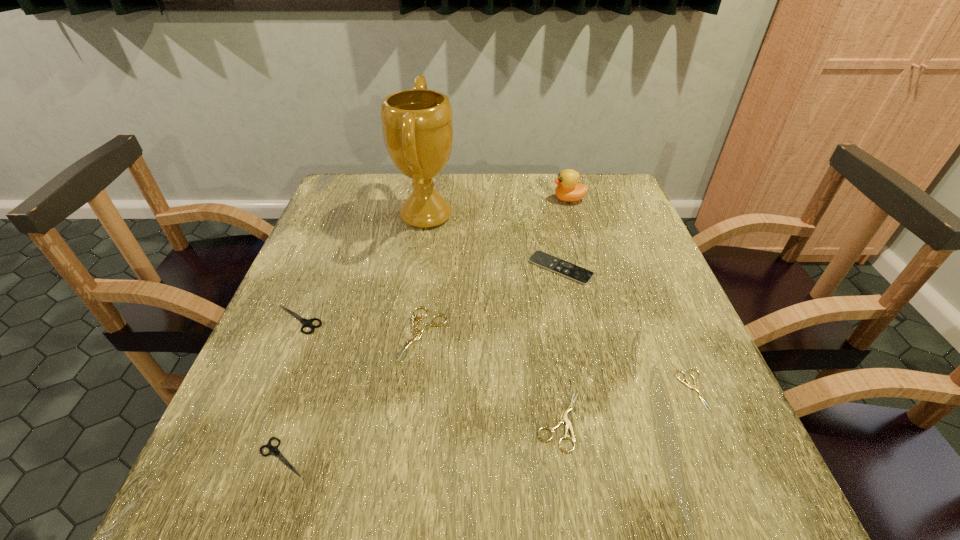
Locate an element on the screen. This screenshot has height=540, width=960. blank region between the third shears from left to right and the tallest object is located at coordinates (424, 275).

At what (x,y) coordinates should I click in order to perform the action: click on empty space that is in between the smallest beige shears and the bigger black shears. Please return your answer as a coordinate pair (x, y). The image size is (960, 540). Looking at the image, I should click on (495, 355).

This screenshot has height=540, width=960. In order to click on free spot between the yellow duckling and the second beige shears from left to right in this screenshot , I will do `click(564, 310)`.

The height and width of the screenshot is (540, 960). I want to click on empty location between the award and the second biggest beige shears, so click(493, 318).

This screenshot has height=540, width=960. Identify the location of free space between the smaller black shears and the award. (x=354, y=336).

Locate an element on the screen. object that ranks as the third closest to the yellow duckling is located at coordinates (417, 333).

I want to click on object identified as the seventh closest to the rightmost shears, so click(306, 322).

I want to click on the closest shears to the bigger black shears, so click(417, 333).

What are the coordinates of `shears that is the third closest one to the sixth shortest object` in the screenshot? It's located at (563, 418).

The height and width of the screenshot is (540, 960). Identify the location of beige shears object that ranks as the closest to the tallest object. (417, 333).